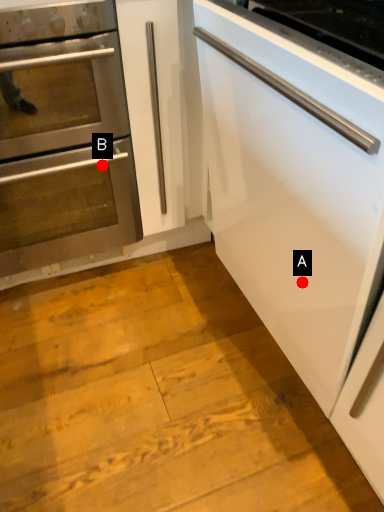
Question: Two points are circled on the image, labeled by A and B beside each circle. Which point is farther from the camera taking this photo?

Choices:
 (A) A is further
 (B) B is further

Answer: (B)